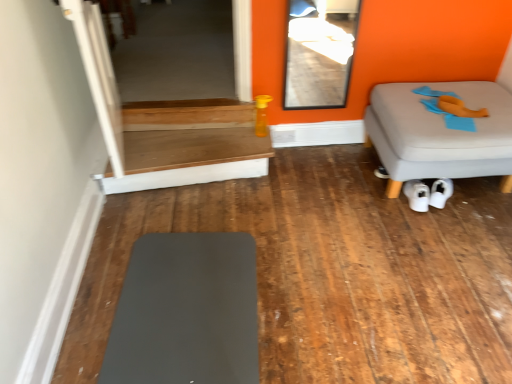
Question: Considering the positions of wooden table at center and transparent glass door at upper left, the second glass door viewed from the front, in the image, is wooden table at center wider or thinner than transparent glass door at upper left, the second glass door viewed from the front,?

Choices:
 (A) wide
 (B) thin

Answer: (B)

Question: From the image's perspective, relative to transparent glass door at upper left, the second glass door viewed from the front, is wooden table at center above or below?

Choices:
 (A) above
 (B) below

Answer: (B)

Question: Which object is the farthest from the white matte sneakers at lower center?

Choices:
 (A) transparent glass door at upper center, the 1th glass door viewed from the front
 (B) wooden table at center
 (C) gray fabric ottoman at right, the first furniture in the top-to-bottom sequence
 (D) matte gray mat at lower left, which appears as the 2th furniture when viewed from the top
 (E) transparent glass door at upper left, the second glass door viewed from the front

Answer: (A)

Question: Which object is the farthest from the gray fabric ottoman at right, which appears as the first furniture when viewed from the back?

Choices:
 (A) white matte sneakers at lower center
 (B) transparent glass door at upper center, marked as the 1th glass door in a right-to-left arrangement
 (C) matte gray mat at lower left, the first furniture from the front
 (D) transparent glass door at upper left, which is the 1th glass door from back to front
 (E) wooden table at center

Answer: (B)